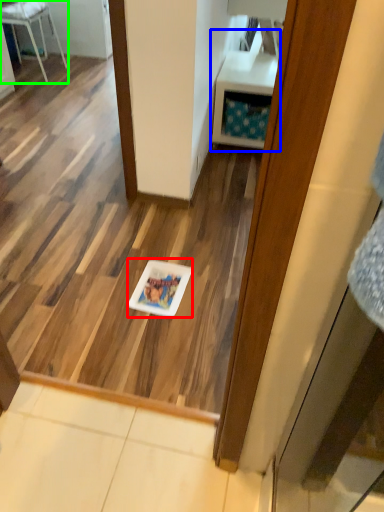
Question: Which object is the farthest from glass plate (highlighted by a red box)? Choose among these: vanity (highlighted by a blue box) or furniture (highlighted by a green box).

Choices:
 (A) vanity
 (B) furniture

Answer: (B)